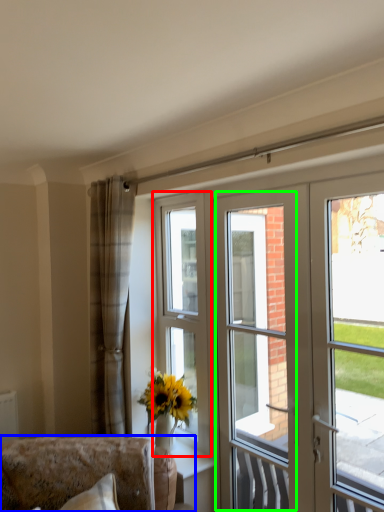
Question: Based on their relative distances, which object is farther from window (highlighted by a red box)? Choose from furniture (highlighted by a blue box) and screen door (highlighted by a green box).

Choices:
 (A) furniture
 (B) screen door

Answer: (B)